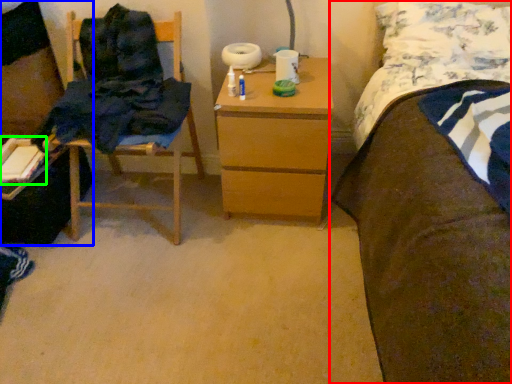
Question: Which object is positioned farthest from bed (highlighted by a red box)? Select from desk (highlighted by a blue box) and book (highlighted by a green box).

Choices:
 (A) desk
 (B) book

Answer: (A)